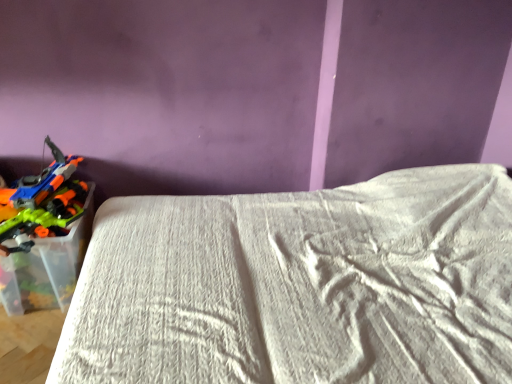
Question: Is translucent plastic toy guns at left inside the boundaries of white textured bed at lower left, or outside?

Choices:
 (A) outside
 (B) inside

Answer: (A)

Question: Would you say translucent plastic toy guns at left is to the left or to the right of white textured bed at lower left in the picture?

Choices:
 (A) left
 (B) right

Answer: (A)

Question: From the image's perspective, relative to white textured bed at lower left, is translucent plastic toy guns at left above or below?

Choices:
 (A) above
 (B) below

Answer: (A)

Question: Is white textured bed at lower left spatially inside translucent plastic toy guns at left, or outside of it?

Choices:
 (A) outside
 (B) inside

Answer: (A)

Question: Is point (313, 304) closer or farther from the camera than point (24, 226)?

Choices:
 (A) closer
 (B) farther

Answer: (A)

Question: Considering their positions, is white textured bed at lower left located in front of or behind translucent plastic toy guns at left?

Choices:
 (A) front
 (B) behind

Answer: (A)

Question: Would you say white textured bed at lower left is to the left or to the right of translucent plastic toy guns at left in the picture?

Choices:
 (A) left
 (B) right

Answer: (B)